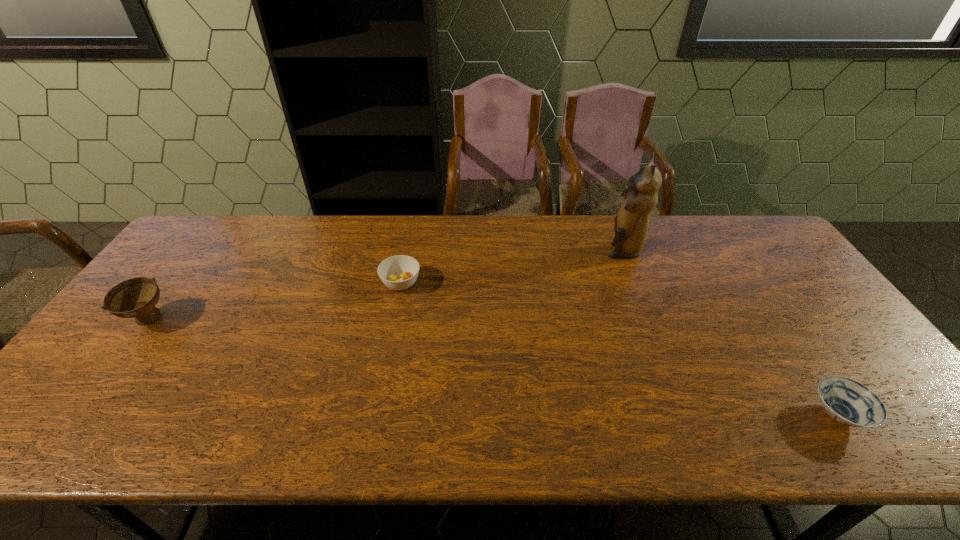
The height and width of the screenshot is (540, 960). I want to click on the tallest object, so click(x=631, y=225).

At what (x,y) coordinates should I click in order to perform the action: click on the farthest object. Please return your answer as a coordinate pair (x, y). The width and height of the screenshot is (960, 540). Looking at the image, I should click on (631, 225).

At what (x,y) coordinates should I click in order to perform the action: click on the second nearest soup bowl. Please return your answer as a coordinate pair (x, y). The width and height of the screenshot is (960, 540). Looking at the image, I should click on (137, 297).

The height and width of the screenshot is (540, 960). In order to click on the leftmost object in this screenshot , I will do `click(137, 297)`.

This screenshot has width=960, height=540. In order to click on the second object from left to right in this screenshot , I will do `click(400, 272)`.

Find the location of a particular element. The height and width of the screenshot is (540, 960). the farthest soup bowl is located at coordinates (400, 272).

The height and width of the screenshot is (540, 960). I want to click on the rightmost object, so click(x=849, y=402).

Locate an element on the screen. Image resolution: width=960 pixels, height=540 pixels. the nearest object is located at coordinates (849, 402).

Where is `free point located on the face of the tallest object`? free point located on the face of the tallest object is located at coordinates (578, 249).

Where is `vacant position located 0.220m on the face of the tallest object`? This screenshot has width=960, height=540. vacant position located 0.220m on the face of the tallest object is located at coordinates (539, 249).